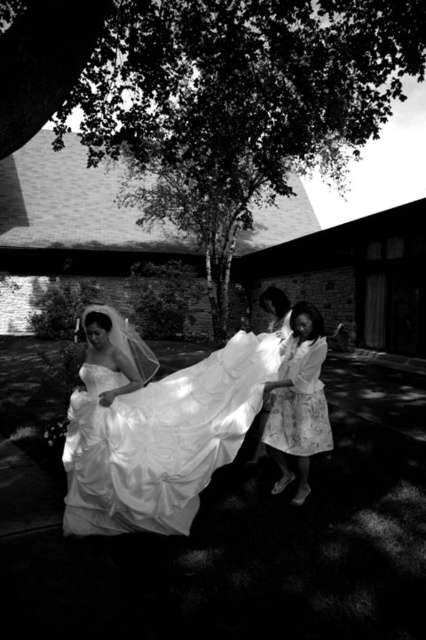
Question: Considering the relative positions of satin/sheer white dress at center and floral cotton dress at lower right in the image provided, where is satin/sheer white dress at center located with respect to floral cotton dress at lower right?

Choices:
 (A) above
 (B) below

Answer: (B)

Question: Can you confirm if satin/sheer white dress at center is thinner than floral cotton dress at lower right?

Choices:
 (A) yes
 (B) no

Answer: (B)

Question: Observing the image, what is the correct spatial positioning of satin/sheer white dress at center in reference to floral cotton dress at lower right?

Choices:
 (A) right
 (B) left

Answer: (B)

Question: Which of the following is the farthest from the observer?

Choices:
 (A) satin/sheer white dress at center
 (B) floral cotton dress at lower right

Answer: (B)

Question: Which point is farther from the camera taking this photo?

Choices:
 (A) (68, 502)
 (B) (316, 321)

Answer: (B)